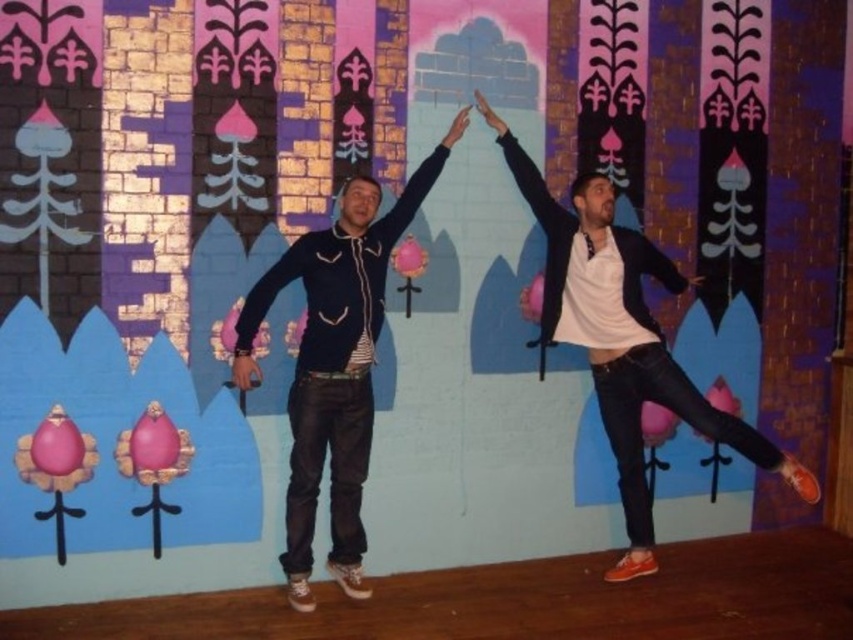
Question: Does matte black jacket at center lie in front of matte black hoodie at center?

Choices:
 (A) no
 (B) yes

Answer: (A)

Question: Considering the relative positions of matte black jacket at center and matte black hoodie at center in the image provided, where is matte black jacket at center located with respect to matte black hoodie at center?

Choices:
 (A) left
 (B) right

Answer: (B)

Question: Can you confirm if matte black jacket at center is positioned above matte black hoodie at center?

Choices:
 (A) yes
 (B) no

Answer: (A)